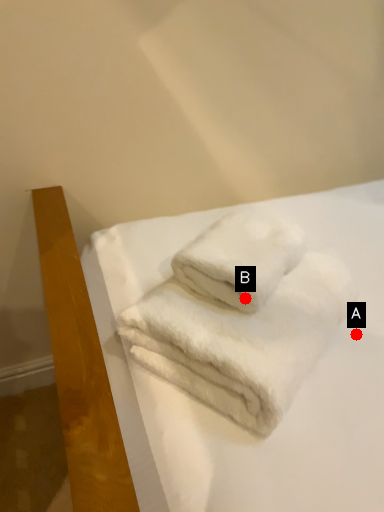
Question: Two points are circled on the image, labeled by A and B beside each circle. Among these points, which one is nearest to the camera?

Choices:
 (A) A is closer
 (B) B is closer

Answer: (B)